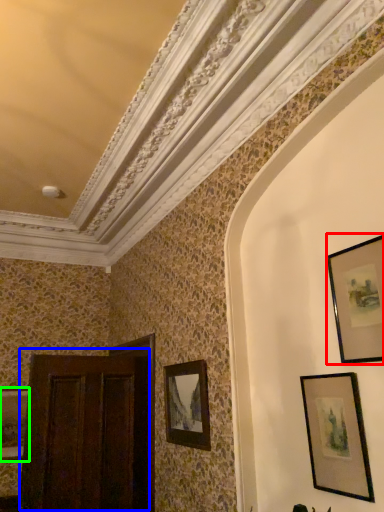
Question: Which object is the closest to the picture frame (highlighted by a red box)? Choose among these: door (highlighted by a blue box) or picture frame (highlighted by a green box).

Choices:
 (A) door
 (B) picture frame

Answer: (A)